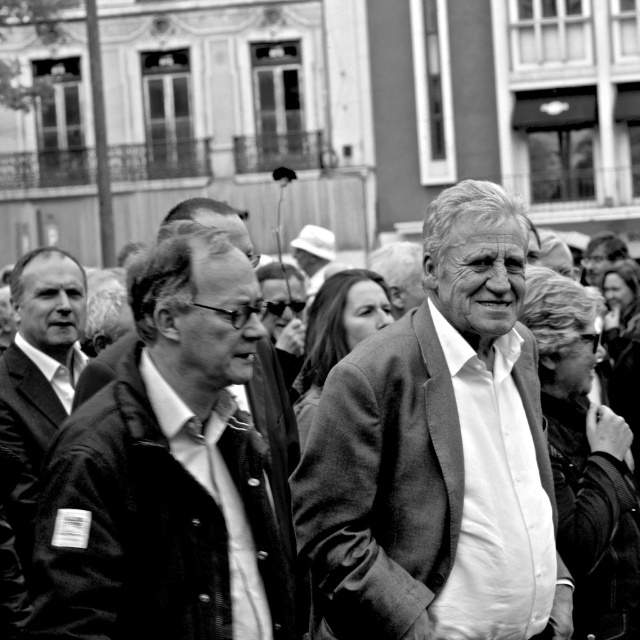
Consider the image. You are standing at the camera position and want to take a closer photo of the smooth fabric jacket at center. Can you estimate how far you need to walk forward to get the jacket to fill the frame?

The smooth fabric jacket at center is 30.99 meters away from the camera. To fill the frame, you would need to move closer to reduce the distance, but the exact distance depends on the camera lens and sensor size. However, based on standard calculations, moving to about 10 meters might be sufficient, but this is approximate.

You are a tailor who needs to determine which garment requires a wider workspace for alterations. Based on the image, which of the two garments at the center, the smooth fabric jacket at center or the smooth gray blazer at center, has a greater width?

The smooth fabric jacket at center has a greater width than the smooth gray blazer at center, so it requires a wider workspace for alterations.